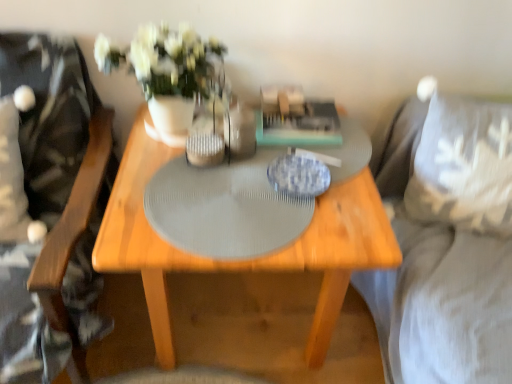
Question: Is wooden swivel chair at left aimed at white ceramic vase at center?

Choices:
 (A) yes
 (B) no

Answer: (B)

Question: From the image's perspective, would you say wooden swivel chair at left is shown under white ceramic vase at center?

Choices:
 (A) yes
 (B) no

Answer: (A)

Question: Is wooden swivel chair at left turned away from white ceramic vase at center?

Choices:
 (A) yes
 (B) no

Answer: (B)

Question: Can you confirm if wooden swivel chair at left is thinner than white ceramic vase at center?

Choices:
 (A) yes
 (B) no

Answer: (B)

Question: Is wooden swivel chair at left directly adjacent to white ceramic vase at center?

Choices:
 (A) no
 (B) yes

Answer: (A)

Question: Considering the relative sizes of wooden swivel chair at left and white ceramic vase at center in the image provided, is wooden swivel chair at left bigger than white ceramic vase at center?

Choices:
 (A) no
 (B) yes

Answer: (B)

Question: From a real-world perspective, does wooden swivel chair at left stand above suede gray couch at right?

Choices:
 (A) no
 (B) yes

Answer: (B)

Question: From the image's perspective, is wooden swivel chair at left located above suede gray couch at right?

Choices:
 (A) no
 (B) yes

Answer: (B)

Question: Is wooden swivel chair at left smaller than suede gray couch at right?

Choices:
 (A) no
 (B) yes

Answer: (B)

Question: Is wooden swivel chair at left at the right side of suede gray couch at right?

Choices:
 (A) no
 (B) yes

Answer: (A)

Question: From a real-world perspective, is wooden swivel chair at left physically below suede gray couch at right?

Choices:
 (A) no
 (B) yes

Answer: (A)

Question: Can you confirm if wooden swivel chair at left is thinner than suede gray couch at right?

Choices:
 (A) yes
 (B) no

Answer: (B)

Question: Is gray textured placemat at center to the left of wooden swivel chair at left from the viewer's perspective?

Choices:
 (A) no
 (B) yes

Answer: (A)